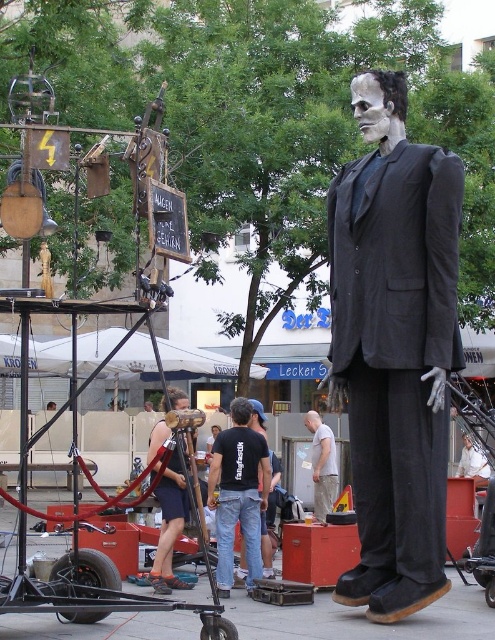
Question: Does wooden microphone at center appear on the right side of light gray cotton t-shirt at center?

Choices:
 (A) yes
 (B) no

Answer: (B)

Question: Does matte black suit at center appear over light gray cotton t-shirt at center?

Choices:
 (A) yes
 (B) no

Answer: (A)

Question: Which object is closer to the camera taking this photo?

Choices:
 (A) black cotton t-shirt at center
 (B) wooden microphone at center
 (C) matte black suit at center

Answer: (B)

Question: Estimate the real-world distances between objects in this image. Which object is closer to the matte black suit at center?

Choices:
 (A) black cotton t-shirt at center
 (B) wooden microphone at center
 (C) light gray cotton t-shirt at center

Answer: (B)

Question: Does matte black suit at center have a smaller size compared to light gray cotton t-shirt at center?

Choices:
 (A) yes
 (B) no

Answer: (B)

Question: Which object is positioned farthest from the matte black suit at center?

Choices:
 (A) wooden microphone at center
 (B) light gray cotton t-shirt at center
 (C) black cotton t-shirt at center

Answer: (B)